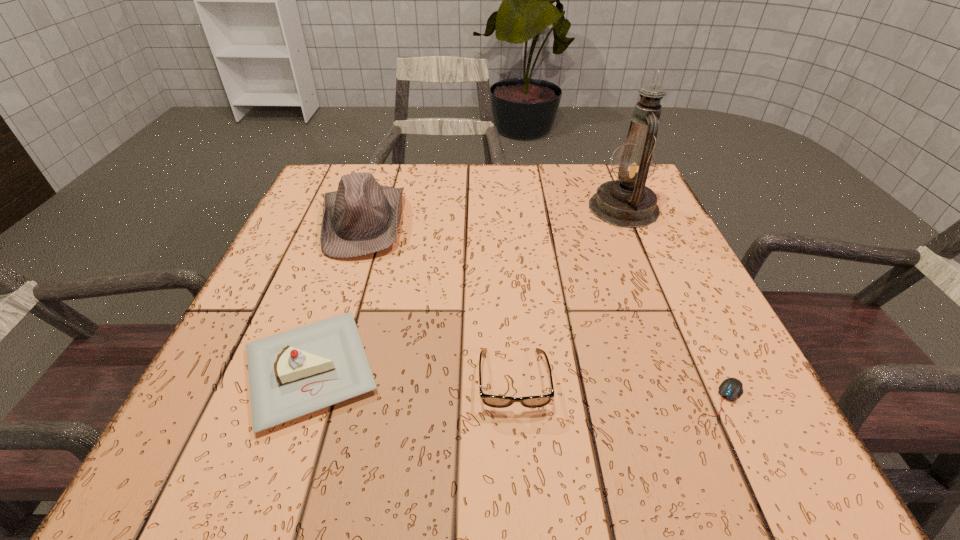
Locate an element on the screen. vacant space that is in between the tallest object and the fourth shortest object is located at coordinates (493, 215).

I want to click on free space between the spectacles and the third shortest object, so click(412, 375).

The width and height of the screenshot is (960, 540). I want to click on free space between the fourth shortest object and the third tallest object, so click(x=337, y=296).

This screenshot has width=960, height=540. Identify the location of blank region between the mouse and the third tallest object. (515, 384).

Identify the location of vacant space that's between the third shortest object and the fedora. (337, 296).

The image size is (960, 540). Identify the location of free space between the third shortest object and the spectacles. 412,375.

At what (x,y) coordinates should I click in order to perform the action: click on free space between the second shortest object and the cake. Please return your answer as a coordinate pair (x, y). Looking at the image, I should click on (412, 375).

Locate which object ranks third in proximity to the spectacles. Please provide its 2D coordinates. Your answer should be formatted as a tuple, i.e. [(x, y)], where the tuple contains the x and y coordinates of a point satisfying the conditions above.

[(361, 217)]

Find the location of a particular element. The width and height of the screenshot is (960, 540). object that is the closest to the third object from right to left is located at coordinates (291, 374).

Locate an element on the screen. vacant point that satisfies the following two spatial constraints: 1. on the lenses of the mouse; 2. on the right side of the third object from left to right is located at coordinates (515, 399).